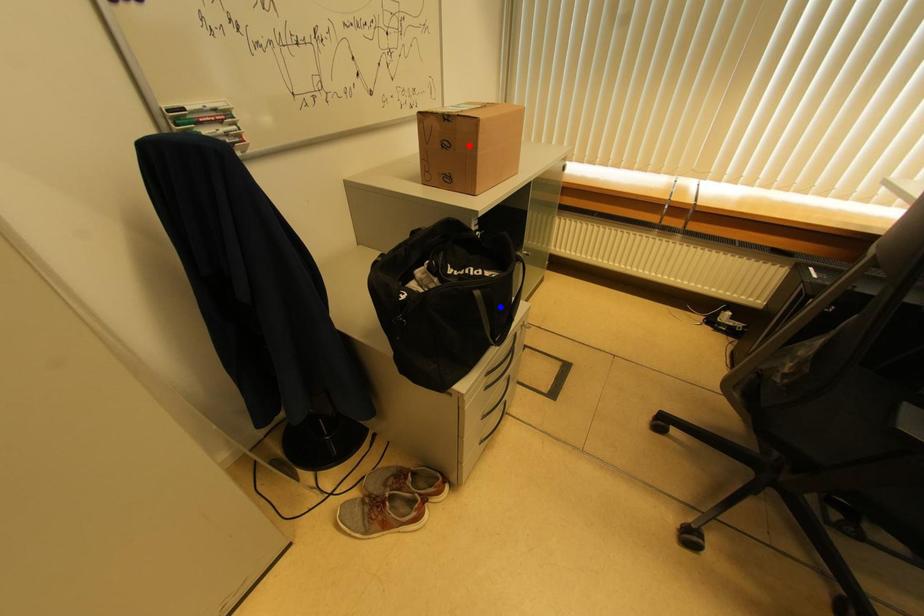
Question: Which of the two points in the image is closer to the camera?

Choices:
 (A) Blue point is closer.
 (B) Red point is closer.

Answer: (A)